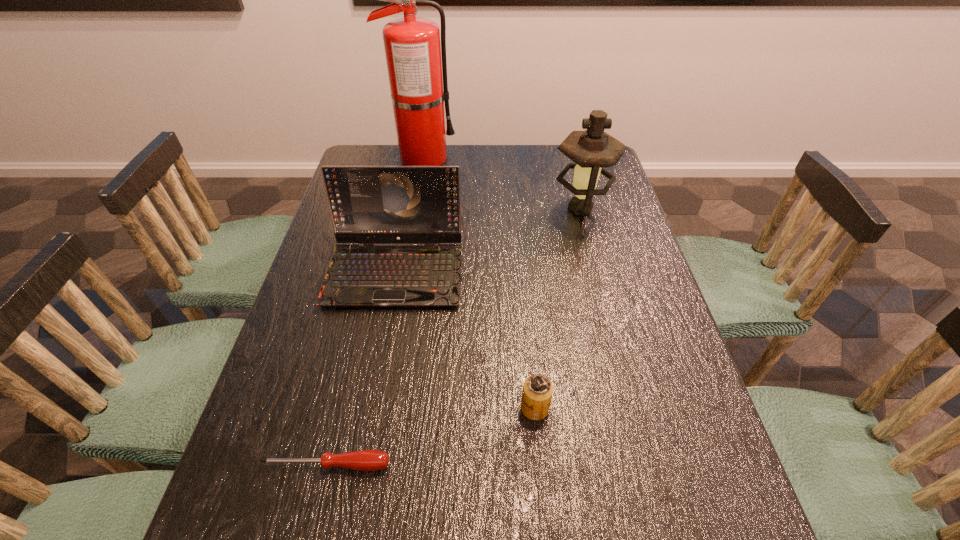
Find the location of a particular element. the tallest object is located at coordinates (413, 52).

Locate an element on the screen. fire extinguisher is located at coordinates (413, 52).

This screenshot has width=960, height=540. In order to click on the fourth shortest object in this screenshot , I will do `click(592, 150)`.

Identify the location of the rightmost object. (592, 150).

Find the location of a particular element. the third nearest object is located at coordinates (369, 205).

Identify the location of the third shortest object. (369, 205).

Find the location of `beer can`. beer can is located at coordinates (537, 393).

You are a GUI agent. You are given a task and a screenshot of the screen. Output one action in this format:
    pyautogui.click(x=<x>, y=<y>)
    Task: Click on the second object from right to left
    This screenshot has width=960, height=540.
    Given the screenshot: What is the action you would take?
    pyautogui.click(x=537, y=393)

Where is `the nearest object`? The height and width of the screenshot is (540, 960). the nearest object is located at coordinates (364, 460).

Where is `the shortest object`? The width and height of the screenshot is (960, 540). the shortest object is located at coordinates (364, 460).